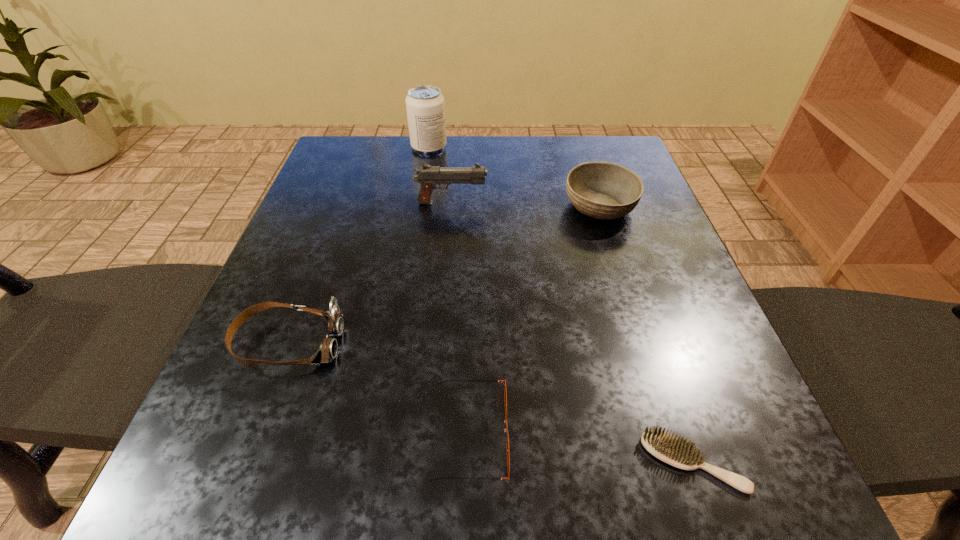
Find the location of a particular element. This screenshot has height=540, width=960. scrubbing brush situated at the right edge is located at coordinates (675, 451).

Find the location of a particular element. Image resolution: width=960 pixels, height=540 pixels. object present at the far right corner is located at coordinates (603, 190).

The height and width of the screenshot is (540, 960). I want to click on object positioned at the near right corner, so click(x=675, y=451).

Where is `vacant space at the far edge`? This screenshot has height=540, width=960. vacant space at the far edge is located at coordinates click(x=564, y=172).

You are a GUI agent. You are given a task and a screenshot of the screen. Output one action in this format:
    pyautogui.click(x=<x>, y=<y>)
    Task: Click on the blank space at the near edge of the desktop
    Image resolution: width=960 pixels, height=540 pixels.
    Given the screenshot: What is the action you would take?
    pyautogui.click(x=488, y=459)

Where is `free spot at the left edge of the desktop`? This screenshot has width=960, height=540. free spot at the left edge of the desktop is located at coordinates (347, 302).

I want to click on vacant area at the right edge, so click(x=609, y=263).

Find the location of a particular element. Image resolution: width=960 pixels, height=540 pixels. vacant space at the far left corner is located at coordinates (355, 185).

Where is `free spot between the fourth shortest object and the second tallest object`? free spot between the fourth shortest object and the second tallest object is located at coordinates (525, 205).

You are a GUI agent. You are given a task and a screenshot of the screen. Output one action in this format:
    pyautogui.click(x=<x>, y=<y>)
    Task: Click on the free space that is in between the shortest object and the second shortest object
    Image resolution: width=960 pixels, height=540 pixels.
    Given the screenshot: What is the action you would take?
    pyautogui.click(x=582, y=448)